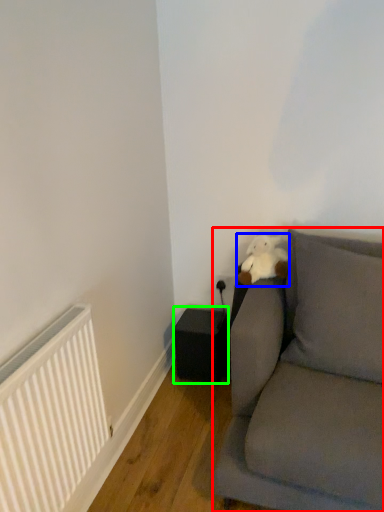
Question: Estimate the real-world distances between objects in this image. Which object is closer to studio couch (highlighted by a red box), teddy (highlighted by a blue box) or speaker (highlighted by a green box)?

Choices:
 (A) teddy
 (B) speaker

Answer: (A)